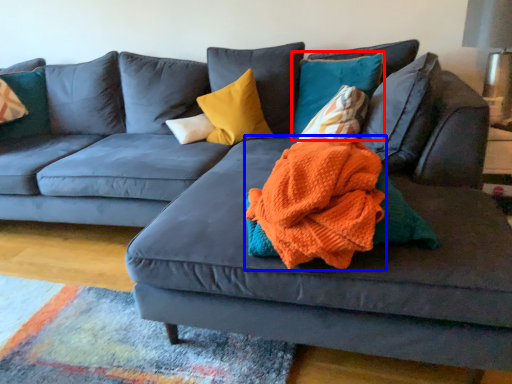
Question: Among these objects, which one is farthest to the camera, pillow (highlighted by a red box) or blanket (highlighted by a blue box)?

Choices:
 (A) pillow
 (B) blanket

Answer: (A)